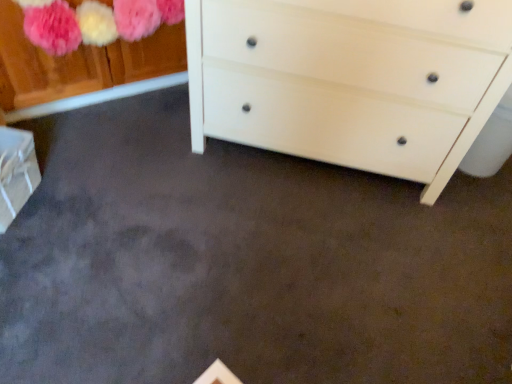
This screenshot has height=384, width=512. What are the coordinates of `vacant space that's between white matte chest of drawers at center and white cardboard box at lower left` in the screenshot? It's located at (170, 178).